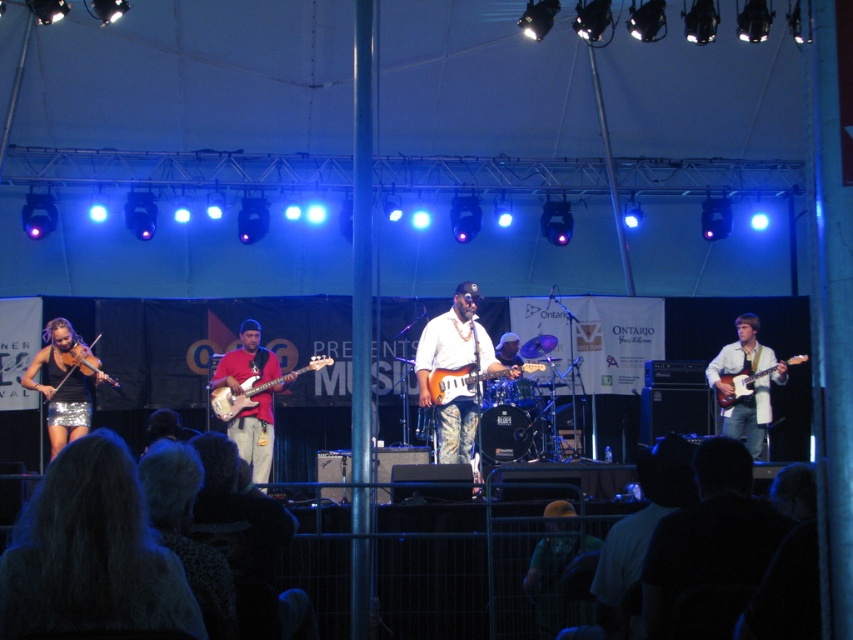
Based on the photo, you are a photographer at the live music performance. You want to capture a photo of the red matte guitar at center and the matte red electric bass at center. Which instrument should you focus on first if you need to adjust your camera focus from top to bottom?

The red matte guitar at center is located below the matte red electric bass at center, so you should focus on the matte red electric bass at center first before adjusting to the lower positioned red matte guitar at center.

You are a photographer positioned in the front row of the live music performance. You want to capture a closeup shot of the white glossy guitar at center. Given that your camera can focus on objects within 10 meters, will you be able to take the photo without moving closer?

The white glossy guitar at center is 10.53 meters away from the viewer, which is beyond the camera focus range of 10 meters. Therefore, you won

You are a photographer setting up for a live music performance. You have a camera with a lens that can focus on objects up to 1.2 meters wide. You need to capture closeup shots of both the white glossy guitar at center and the matte black violin at left. Based on their widths, which instrument should you prioritize focusing on first to ensure it fits within your camera lens?

The white glossy guitar at center is wider than the matte black violin at left. Since the guitar is wider, you should prioritize focusing on the white glossy guitar at center first to ensure it fits within the camera lens before the narrower violin.